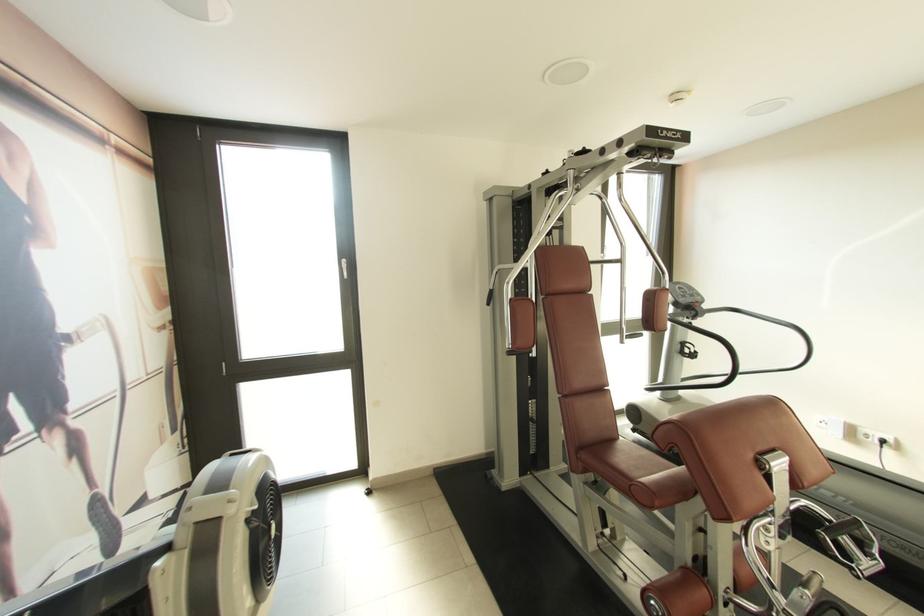
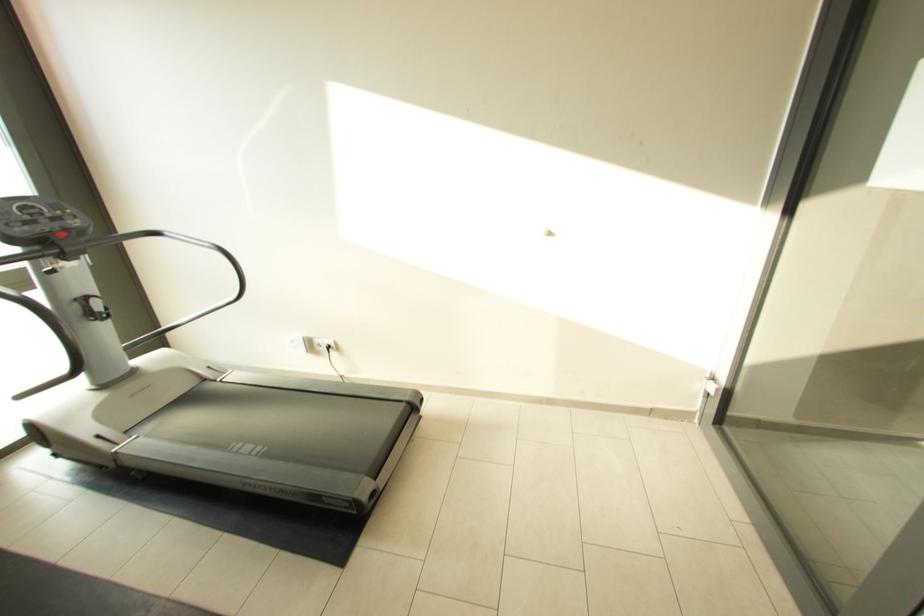
Question: I am providing you with two images of the same scene from different viewpoints. After the viewpoint changes to image2, which objects are now occluded?

Choices:
 (A) power outlet socket
 (B) black electrical plug
 (C) red treadmill button
 (D) none of these

Answer: (D)